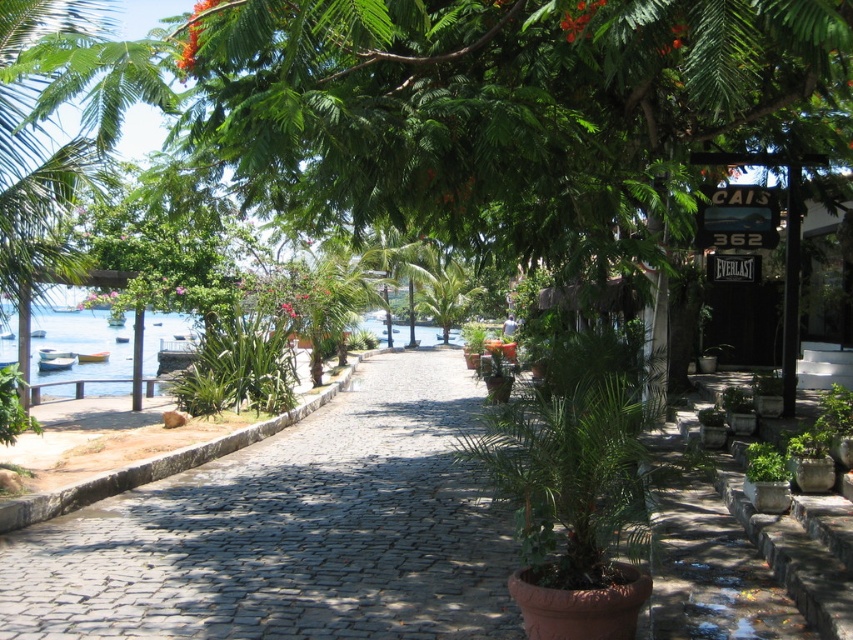
You are a gardener who needs to plant a new tree in the pathway. The new tree will grow to be 3 meters wide. The green leafy tree at center and the cobblestone pavement at center are in your way. Which object should you avoid to ensure the new tree has enough space to grow?

The green leafy tree at center has a lesser width compared to the cobblestone pavement at center. Therefore, you should avoid the cobblestone pavement at center as it is wider and may not leave enough space for the new tree to grow to its full width of 3 meters.

You are a tourist walking along the cobblestone pavement at center and want to take a photo of the green leafy tree at center. In which direction should you face to capture the tree in your shot?

The green leafy tree at center is positioned on the right side of cobblestone pavement at center, so you should face to the right to capture the tree in your shot.

You are a gardener who needs to water the green leafy tree at center and the cobblestone pavement at center. Which one is closer to you?

The green leafy tree at center is 5.20 meters away from the cobblestone pavement at center, so the cobblestone pavement at center is closer to you than the tree.